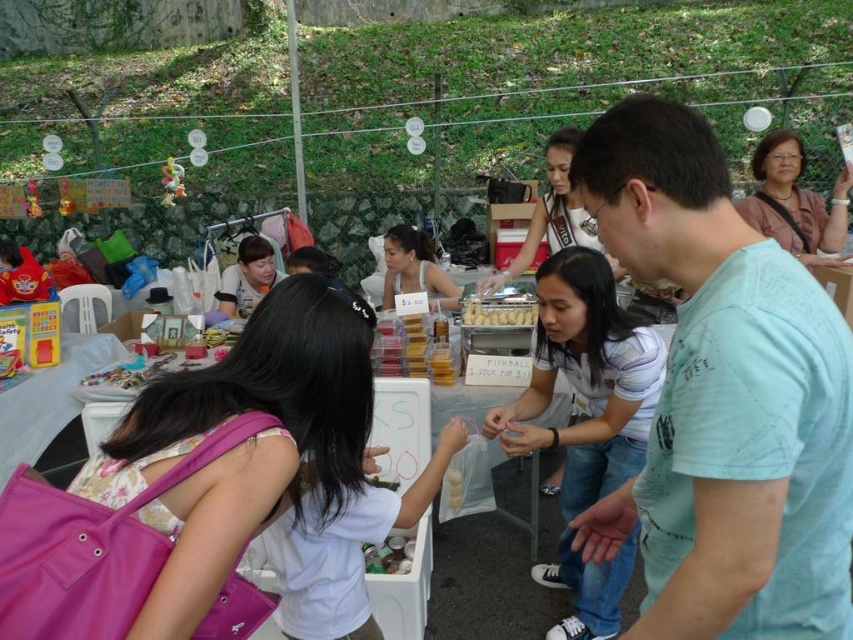
Question: Which of the following is the farthest from the observer?

Choices:
 (A) (798, 570)
 (B) (247, 292)
 (C) (165, 168)
 (D) (62, 195)

Answer: (D)

Question: Which of the following is the farthest from the observer?

Choices:
 (A) (538, 396)
 (B) (451, 307)
 (C) (36, 196)

Answer: (C)

Question: Which is nearer to the light blue cotton shirt at center?

Choices:
 (A) plush yellow bear at upper left
 (B) white tank top at center
 (C) plush yellow toy at upper left

Answer: (B)

Question: Does light blue cotton shirt at center have a lesser width compared to plush yellow bear at upper left?

Choices:
 (A) yes
 (B) no

Answer: (B)

Question: Is yellow matte candy at center further to camera compared to metallic gold figurine at upper left?

Choices:
 (A) no
 (B) yes

Answer: (A)

Question: Can you confirm if white tank top at center is positioned to the left of yellow matte candy at center?

Choices:
 (A) no
 (B) yes

Answer: (B)